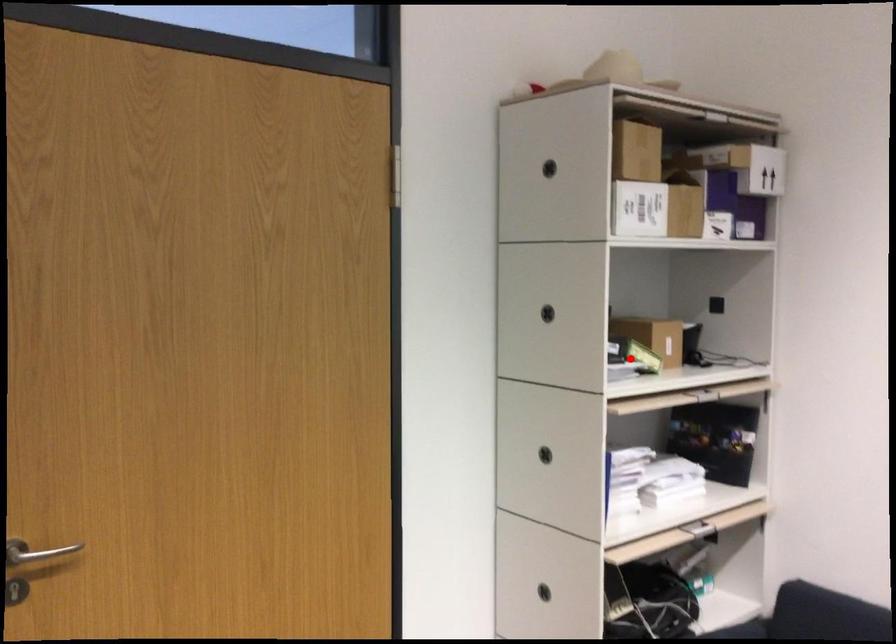
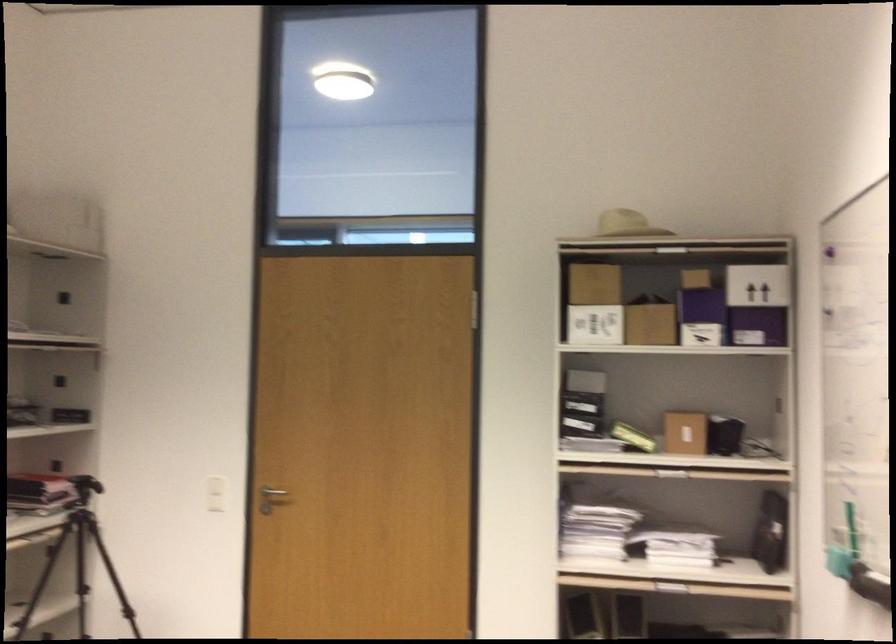
The point at the highlighted location is marked in the first image. Where is the corresponding point in the second image?

(633, 437)